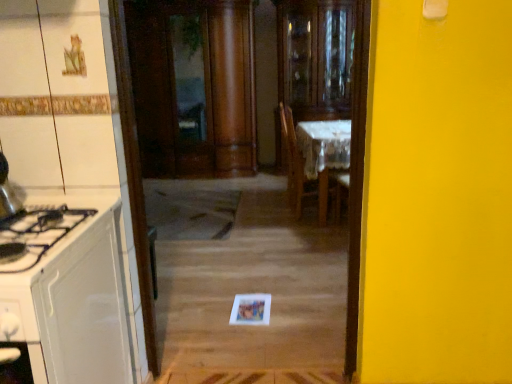
Question: Considering the positions of white lace tablecloth at center and white glossy cabinet at left in the image, is white lace tablecloth at center taller or shorter than white glossy cabinet at left?

Choices:
 (A) short
 (B) tall

Answer: (B)

Question: From a real-world perspective, is white lace tablecloth at center above or below white glossy cabinet at left?

Choices:
 (A) above
 (B) below

Answer: (A)

Question: Considering the real-world distances, which object is farthest from the transparent glass cabinet at center?

Choices:
 (A) white glossy cabinet at left
 (B) white lace tablecloth at center

Answer: (A)

Question: Estimate the real-world distances between objects in this image. Which object is closer to the white lace tablecloth at center?

Choices:
 (A) white glossy cabinet at left
 (B) transparent glass cabinet at center

Answer: (B)